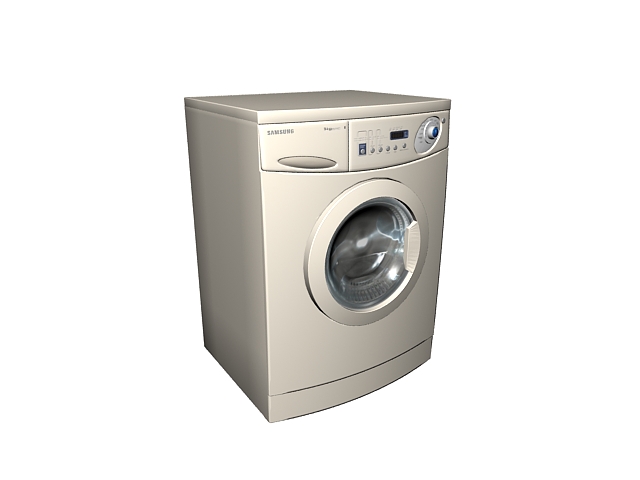
The image size is (640, 480). I want to click on top of washer, so click(x=333, y=99).